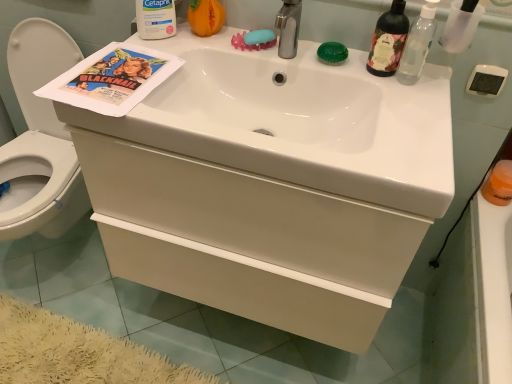
Question: Is white glossy sink at center with transparent plastic bottle at upper right, which is counted as the third bottle, starting from the left?

Choices:
 (A) yes
 (B) no

Answer: (B)

Question: Is white glossy sink at center not within transparent plastic bottle at upper right, the 1th bottle from the right?

Choices:
 (A) no
 (B) yes

Answer: (B)

Question: Considering the relative sizes of white glossy sink at center and transparent plastic bottle at upper right, which is counted as the third bottle, starting from the left, in the image provided, is white glossy sink at center smaller than transparent plastic bottle at upper right, which is counted as the third bottle, starting from the left,?

Choices:
 (A) yes
 (B) no

Answer: (B)

Question: From the image's perspective, is white glossy sink at center below transparent plastic bottle at upper right, which is counted as the third bottle, starting from the left?

Choices:
 (A) no
 (B) yes

Answer: (B)

Question: From the image's perspective, would you say white glossy sink at center is positioned over transparent plastic bottle at upper right, the 1th bottle from the right?

Choices:
 (A) yes
 (B) no

Answer: (B)

Question: Considering the relative positions of green translucent soap at upper center, which is counted as the 1th soap, starting from the right, and orange plastic cup at right in the image provided, is green translucent soap at upper center, which is counted as the 1th soap, starting from the right, to the left or to the right of orange plastic cup at right?

Choices:
 (A) left
 (B) right

Answer: (A)

Question: In terms of width, does green translucent soap at upper center, which is counted as the 1th soap, starting from the right, look wider or thinner when compared to orange plastic cup at right?

Choices:
 (A) wide
 (B) thin

Answer: (B)

Question: Is point (342, 44) closer or farther from the camera than point (500, 162)?

Choices:
 (A) closer
 (B) farther

Answer: (A)

Question: Choose the correct answer: Is green translucent soap at upper center, which is counted as the 1th soap, starting from the right, inside orange plastic cup at right or outside it?

Choices:
 (A) outside
 (B) inside

Answer: (A)

Question: Is matte paper poster at upper left wider or thinner than white glossy sink at center?

Choices:
 (A) wide
 (B) thin

Answer: (B)

Question: Is matte paper poster at upper left taller or shorter than white glossy sink at center?

Choices:
 (A) short
 (B) tall

Answer: (A)

Question: Looking at the image, does matte paper poster at upper left seem bigger or smaller compared to white glossy sink at center?

Choices:
 (A) big
 (B) small

Answer: (B)

Question: Considering the relative positions of matte paper poster at upper left and white glossy sink at center in the image provided, is matte paper poster at upper left to the left or to the right of white glossy sink at center?

Choices:
 (A) left
 (B) right

Answer: (A)

Question: From the image's perspective, is white matte drawer at center above or below transparent plastic bottle at upper right, the 1th bottle from the right?

Choices:
 (A) above
 (B) below

Answer: (B)

Question: Is point (182, 192) closer or farther from the camera than point (426, 0)?

Choices:
 (A) closer
 (B) farther

Answer: (A)